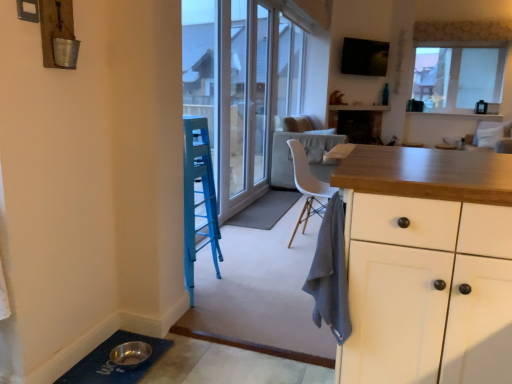
Question: Do you think white fabric armchair at upper right is within white glossy screen door at center, or outside of it?

Choices:
 (A) inside
 (B) outside

Answer: (B)

Question: In the image, is white fabric armchair at upper right positioned in front of or behind white glossy screen door at center?

Choices:
 (A) front
 (B) behind

Answer: (B)

Question: Which object is the closest to the blue rubber doormat at lower left, marked as the 2th doormat in a top-to-bottom arrangement?

Choices:
 (A) transparent glass window at upper right
 (B) gray fabric doormat at center, placed as the 1th doormat when sorted from back to front
 (C) white plastic chair at center
 (D) gray cotton towel at center
 (E) white glossy screen door at center

Answer: (D)

Question: Considering the real-world distances, which object is farthest from the gray cotton towel at center?

Choices:
 (A) white fabric armchair at upper right
 (B) white plastic chair at center
 (C) white glossy screen door at center
 (D) gray fabric doormat at center, marked as the 1th doormat in a top-to-bottom arrangement
 (E) blue rubber doormat at lower left, positioned as the first doormat in bottom-to-top order

Answer: (A)